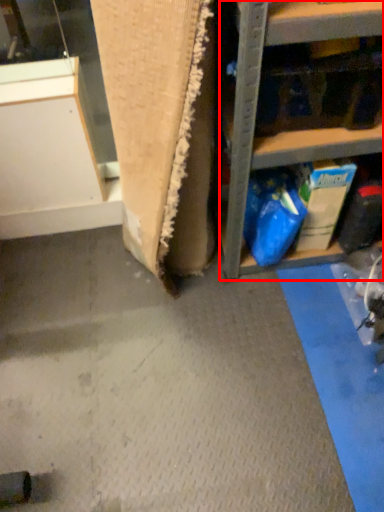
Question: From the image's perspective, where is shelf (annotated by the red box) located in relation to cabinetry in the image?

Choices:
 (A) above
 (B) below

Answer: (A)